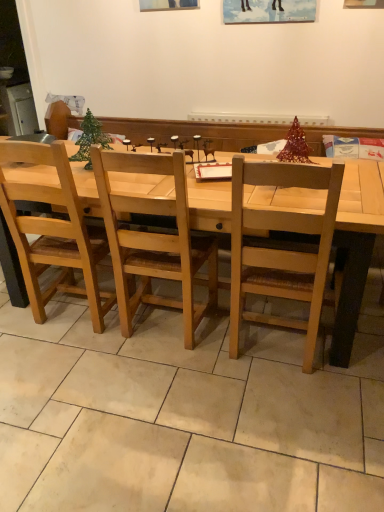
Describe the element at coordinates (53, 232) in the screenshot. I see `light brown wood chair at center, the second chair positioned from the right` at that location.

Describe the element at coordinates (356, 246) in the screenshot. I see `natural wood table at center` at that location.

You are a GUI agent. You are given a task and a screenshot of the screen. Output one action in this format:
    pyautogui.click(x=<x>, y=<y>)
    Task: Click on the metallic green christmas tree at center
    
    Given the screenshot: What is the action you would take?
    pyautogui.click(x=90, y=139)

Which of these two, light wood chair at center, the 2th chair viewed from the left, or metallic green christmas tree at center, is bigger?

Bigger between the two is light wood chair at center, the 2th chair viewed from the left.

Relative to metallic green christmas tree at center, is light wood chair at center, the 2th chair viewed from the left, in front or behind?

Clearly, light wood chair at center, the 2th chair viewed from the left, is in front of metallic green christmas tree at center.

Is light wood chair at center, the 1th chair viewed from the right, oriented away from metallic green christmas tree at center?

No, metallic green christmas tree at center is not at the back of light wood chair at center, the 1th chair viewed from the right.

Which is nearer, (240, 221) or (107, 142)?

The point (240, 221) is closer.

Consider the image. How many degrees apart are the facing directions of natural wood table at center and light wood chair at center, the 1th chair viewed from the right?

The angle between the facing direction of natural wood table at center and the facing direction of light wood chair at center, the 1th chair viewed from the right, is 179 degrees.

Who is shorter, natural wood table at center or light wood chair at center, the 1th chair viewed from the right?

Standing shorter between the two is natural wood table at center.

From a real-world perspective, is natural wood table at center physically located above or below light wood chair at center, the 1th chair viewed from the right?

natural wood table at center is below light wood chair at center, the 1th chair viewed from the right.

Does natural wood table at center have a greater width compared to light wood chair at center, the 1th chair viewed from the right?

Yes, natural wood table at center is wider than light wood chair at center, the 1th chair viewed from the right.

Does metallic green christmas tree at center have a greater width compared to light wood chair at center, the 2th chair viewed from the left?

Incorrect, the width of metallic green christmas tree at center does not surpass that of light wood chair at center, the 2th chair viewed from the left.

From a real-world perspective, is metallic green christmas tree at center above or below light wood chair at center, the 1th chair viewed from the right?

metallic green christmas tree at center is situated higher than light wood chair at center, the 1th chair viewed from the right, in the real world.

Which point is more distant from viewer, (90, 143) or (299, 279)?

Positioned behind is point (90, 143).

Is the depth of metallic green christmas tree at center less than that of light wood chair at center, the 2th chair viewed from the left?

No, it is behind light wood chair at center, the 2th chair viewed from the left.

Can you confirm if light brown wood chair at center, the second chair positioned from the right, is shorter than natural wood table at center?

Incorrect, the height of light brown wood chair at center, the second chair positioned from the right, does not fall short of that of natural wood table at center.

Considering the positions of objects light brown wood chair at center, the second chair positioned from the right, and natural wood table at center in the image provided, who is more to the left, light brown wood chair at center, the second chair positioned from the right, or natural wood table at center?

light brown wood chair at center, the second chair positioned from the right, is more to the left.

Between light brown wood chair at center, the second chair positioned from the right, and natural wood table at center, which one has larger size?

Bigger between the two is natural wood table at center.

Which of these two, light brown wood chair at center, the second chair positioned from the right, or metallic green christmas tree at center, is thinner?

metallic green christmas tree at center is thinner.

Is light brown wood chair at center, the first chair positioned from the left, looking in the opposite direction of metallic green christmas tree at center?

light brown wood chair at center, the first chair positioned from the left, does not have its back to metallic green christmas tree at center.

I want to click on the 1st chair in front of the metallic green christmas tree at center, so click(x=53, y=232).

Is light brown wood chair at center, the first chair positioned from the left, not near metallic green christmas tree at center?

Actually, light brown wood chair at center, the first chair positioned from the left, and metallic green christmas tree at center are a little close together.

Is light brown wood chair at center, the second chair positioned from the right, at the left side of light wood chair at center, the 2th chair viewed from the left?

Correct, you'll find light brown wood chair at center, the second chair positioned from the right, to the left of light wood chair at center, the 2th chair viewed from the left.

Is light brown wood chair at center, the second chair positioned from the right, not inside light wood chair at center, the 1th chair viewed from the right?

light brown wood chair at center, the second chair positioned from the right, is positioned outside light wood chair at center, the 1th chair viewed from the right.

Between light brown wood chair at center, the second chair positioned from the right, and light wood chair at center, the 2th chair viewed from the left, which one has less height?

With less height is light wood chair at center, the 2th chair viewed from the left.

How much distance is there between light brown wood chair at center, the first chair positioned from the left, and light wood chair at center, the 1th chair viewed from the right?

The distance of light brown wood chair at center, the first chair positioned from the left, from light wood chair at center, the 1th chair viewed from the right, is 36.59 inches.

From the image's perspective, is metallic green christmas tree at center beneath natural wood table at center?

Incorrect, from the image's perspective, metallic green christmas tree at center is higher than natural wood table at center.

Does metallic green christmas tree at center touch natural wood table at center?

No, metallic green christmas tree at center is not next to natural wood table at center.

Does point (97, 131) come farther from viewer compared to point (331, 355)?

Yes, it is.

Looking at this image, is metallic green christmas tree at center at the right side of natural wood table at center?

Incorrect, metallic green christmas tree at center is not on the right side of natural wood table at center.

At what (x,y) coordinates should I click in order to perform the action: click on christmas tree to the left of light wood chair at center, the 1th chair viewed from the right. Please return your answer as a coordinate pair (x, y). The image size is (384, 512). Looking at the image, I should click on click(90, 139).

This screenshot has height=512, width=384. In order to click on chair on the right of natural wood table at center in this screenshot , I will do click(281, 248).

From the image, which object appears to be farther from metallic green christmas tree at center, light brown wood chair at center, the second chair positioned from the right, or natural wood table at center?

natural wood table at center is further to metallic green christmas tree at center.

Looking at the image, which one is located closer to light wood chair at center, the 1th chair viewed from the right, metallic green christmas tree at center or light brown wood chair at center, the second chair positioned from the right?

light brown wood chair at center, the second chair positioned from the right, is closer to light wood chair at center, the 1th chair viewed from the right.

Estimate the real-world distances between objects in this image. Which object is further from light brown wood chair at center, the second chair positioned from the right, metallic green christmas tree at center or natural wood table at center?

natural wood table at center is positioned further to the anchor light brown wood chair at center, the second chair positioned from the right.

Which object lies further to the anchor point metallic green christmas tree at center, natural wood table at center or light wood chair at center, the 1th chair viewed from the right?

light wood chair at center, the 1th chair viewed from the right, is positioned further to the anchor metallic green christmas tree at center.

Based on their spatial positions, is light wood chair at center, the 1th chair viewed from the right, or metallic green christmas tree at center closer to light brown wood chair at center, the first chair positioned from the left?

metallic green christmas tree at center is closer to light brown wood chair at center, the first chair positioned from the left.

Based on their spatial positions, is metallic green christmas tree at center or natural wood table at center further from light wood chair at center, the 1th chair viewed from the right?

The object further to light wood chair at center, the 1th chair viewed from the right, is metallic green christmas tree at center.

When comparing their distances from natural wood table at center, does light brown wood chair at center, the second chair positioned from the right, or metallic green christmas tree at center seem closer?

Among the two, light brown wood chair at center, the second chair positioned from the right, is located nearer to natural wood table at center.

Looking at the image, which one is located further to metallic green christmas tree at center, light wood chair at center, the 1th chair viewed from the right, or light brown wood chair at center, the first chair positioned from the left?

light wood chair at center, the 1th chair viewed from the right, is positioned further to the anchor metallic green christmas tree at center.

Identify the location of desk located between light brown wood chair at center, the second chair positioned from the right, and light wood chair at center, the 1th chair viewed from the right, in the left-right direction. (356, 246).

The height and width of the screenshot is (512, 384). I want to click on chair between natural wood table at center and metallic green christmas tree at center in the front-back direction, so click(53, 232).

Where is `desk between metallic green christmas tree at center and light wood chair at center, the 1th chair viewed from the right, from left to right`? desk between metallic green christmas tree at center and light wood chair at center, the 1th chair viewed from the right, from left to right is located at coordinates (356, 246).

This screenshot has width=384, height=512. Identify the location of christmas tree located between light brown wood chair at center, the first chair positioned from the left, and light wood chair at center, the 2th chair viewed from the left, in the left-right direction. (90, 139).